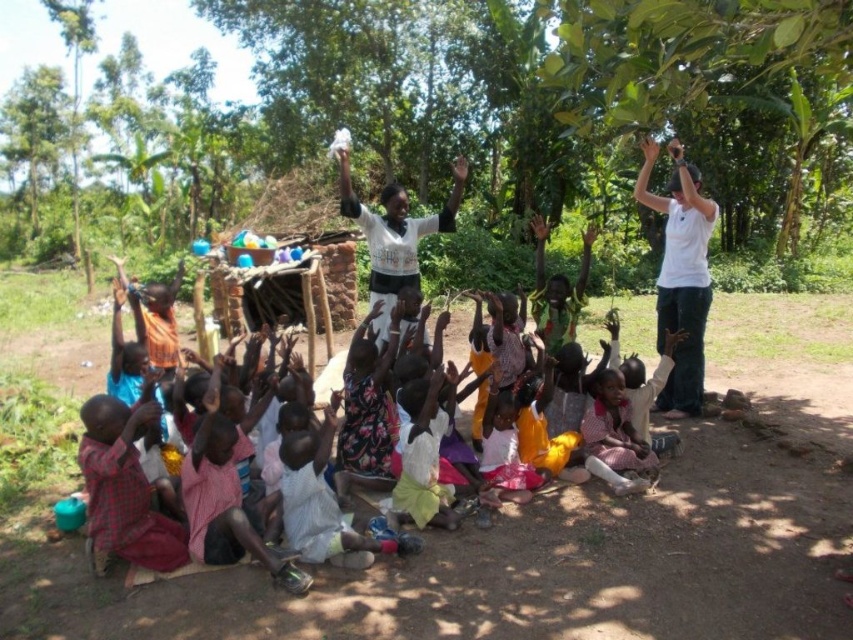
You are a drone operator trying to capture a photo of the green leafy tree at upper center in the scene. The drone is currently hovering at point with coordinates point (433,120). Can you confirm if the drone is positioned correctly to take a clear photo of the green leafy tree at upper center?

Yes, the drone is positioned correctly because the point (433,120) is on the green leafy tree at upper center, so the drone can take a clear photo of it.

You are standing at the edge of the brown dirt field at center and want to toss a ball to a friend who is standing exactly where the viewer is positioned. If you can throw the ball 3 meters, will you be able to reach your friend?

The brown dirt field at center and viewer are 3.42 meters apart from each other. Since your throwing distance is 3 meters, which is less than 3.42 meters, you won answer be able to reach your friend.